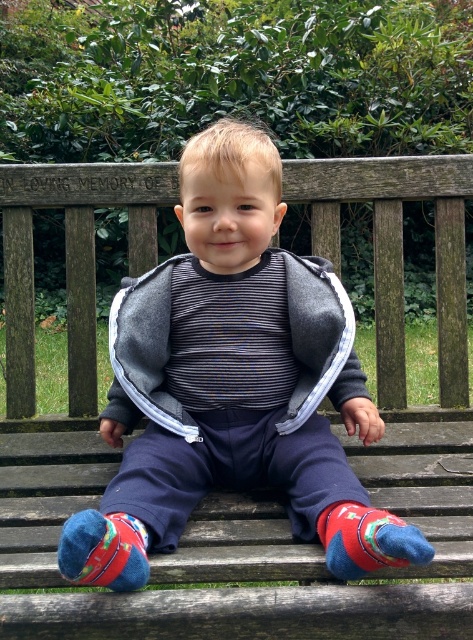
Question: Is matte gray vest at center in front of red matte sock at lower right?

Choices:
 (A) yes
 (B) no

Answer: (B)

Question: Does red matte sock at lower right appear on the right side of multicolored felt sock at lower left?

Choices:
 (A) no
 (B) yes

Answer: (B)

Question: Which point is farther from the camera taking this photo?

Choices:
 (A) (122, 387)
 (B) (131, 540)
 (C) (370, 568)

Answer: (A)

Question: Which object is closer to the camera taking this photo?

Choices:
 (A) red matte sock at lower right
 (B) multicolored felt sock at lower left
 (C) matte gray vest at center

Answer: (A)

Question: Which of the following is the farthest from the observer?

Choices:
 (A) red matte sock at lower right
 (B) matte gray vest at center

Answer: (B)

Question: Does red matte sock at lower right have a lesser width compared to multicolored felt sock at lower left?

Choices:
 (A) yes
 (B) no

Answer: (B)